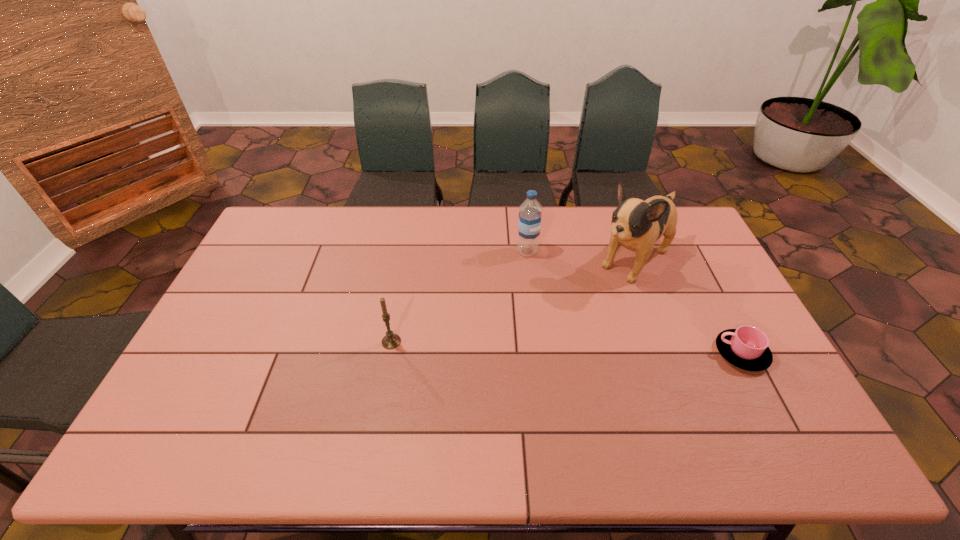
Find the location of `vacant space located at the face of the tallest object`. vacant space located at the face of the tallest object is located at coordinates (588, 301).

Identify the location of vacant space positioned 0.390m at the face of the tallest object. The image size is (960, 540). (534, 349).

Locate an element on the screen. The image size is (960, 540). vacant space located 0.270m at the face of the tallest object is located at coordinates (560, 326).

Find the location of a particular element. The height and width of the screenshot is (540, 960). vacant space located on the label of the water bottle is located at coordinates (560, 293).

This screenshot has height=540, width=960. I want to click on vacant space located 0.220m on the label of the water bottle, so click(x=565, y=301).

Where is `free space located on the label of the water bottle`? free space located on the label of the water bottle is located at coordinates tap(595, 339).

Identify the location of puppy that is at the far edge. Image resolution: width=960 pixels, height=540 pixels. (636, 224).

Find the location of a particular element. The image size is (960, 540). water bottle that is at the far edge is located at coordinates (529, 223).

The image size is (960, 540). I want to click on cup present at the right edge, so click(x=746, y=347).

What are the coordinates of `puppy that is at the right edge` in the screenshot? It's located at (636, 224).